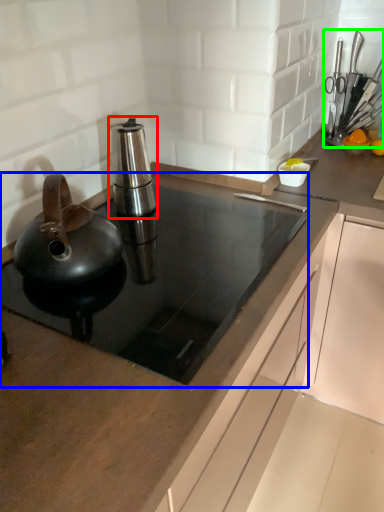
Question: Which is nearer to the kitchen appliance (highlighted by a red box)? gas stove (highlighted by a blue box) or appliance (highlighted by a green box).

Choices:
 (A) gas stove
 (B) appliance

Answer: (A)